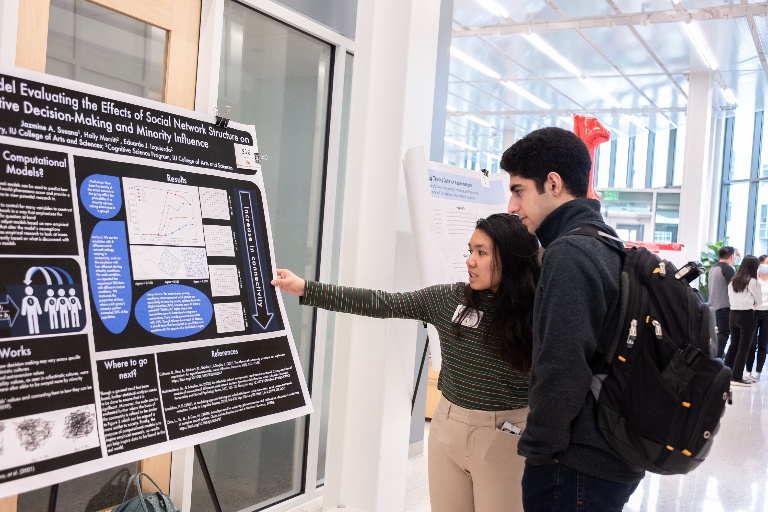
Locate an element on the screen. floor is located at coordinates (720, 482).